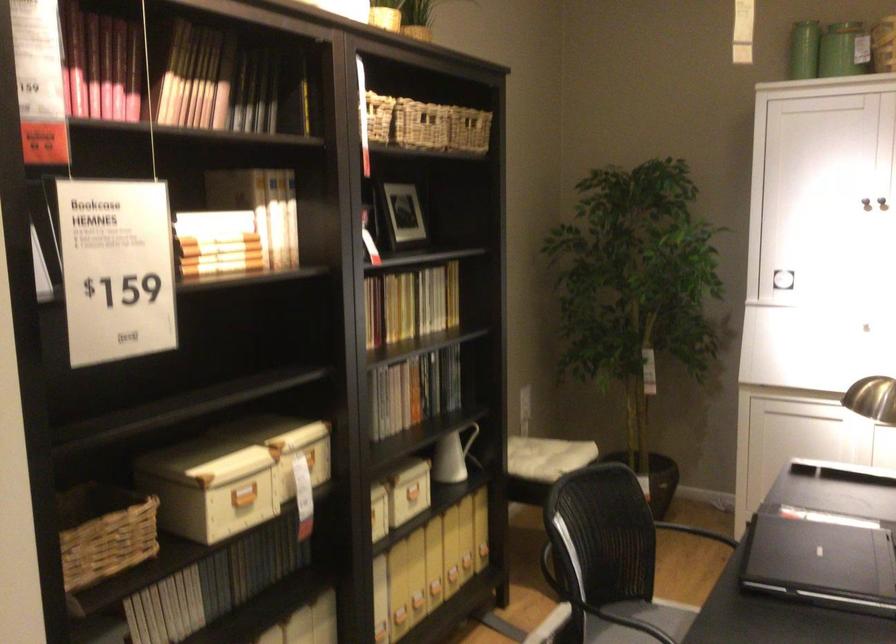
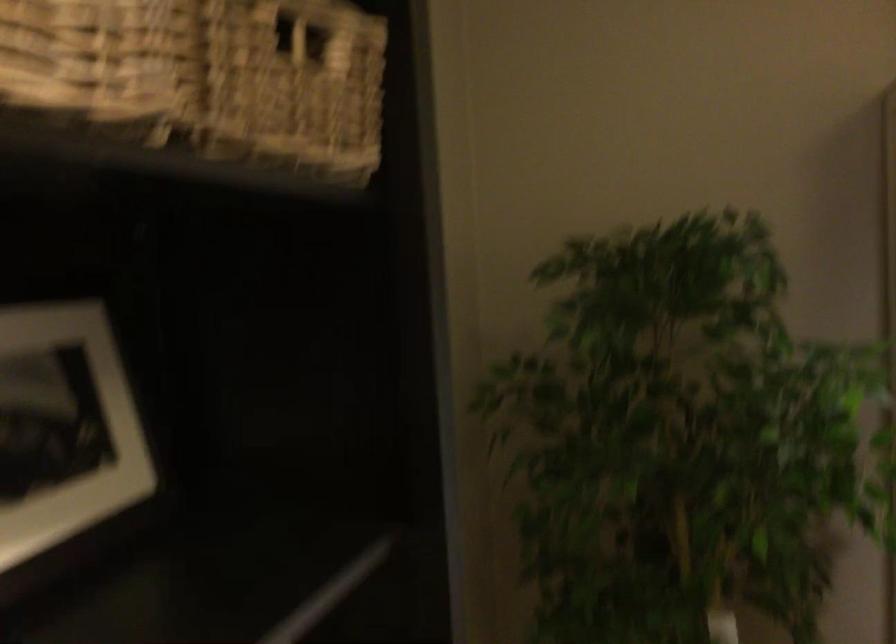
Question: In a continuous first-person perspective shot, in which direction is the camera moving?

Choices:
 (A) Left
 (B) Right
 (C) Forward
 (D) Backward

Answer: (C)